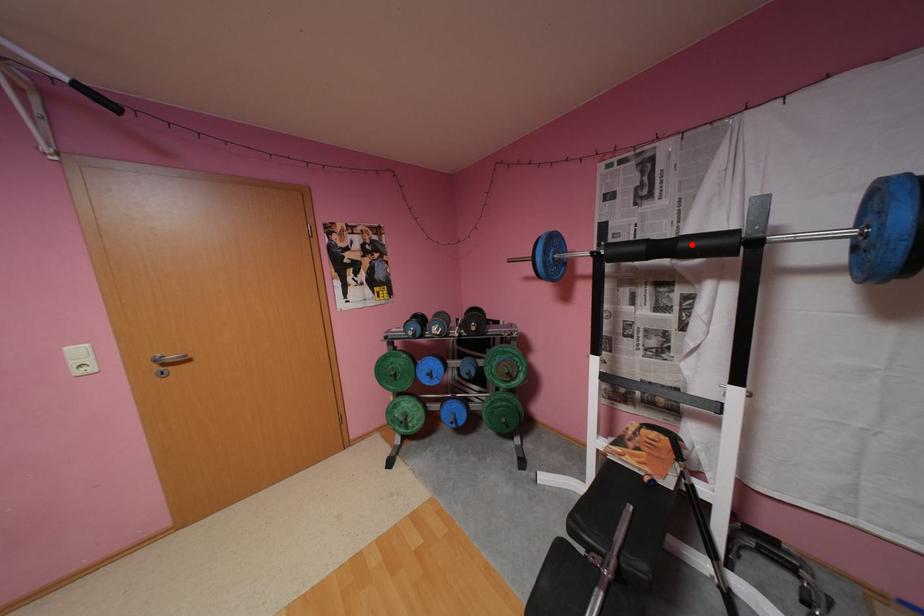
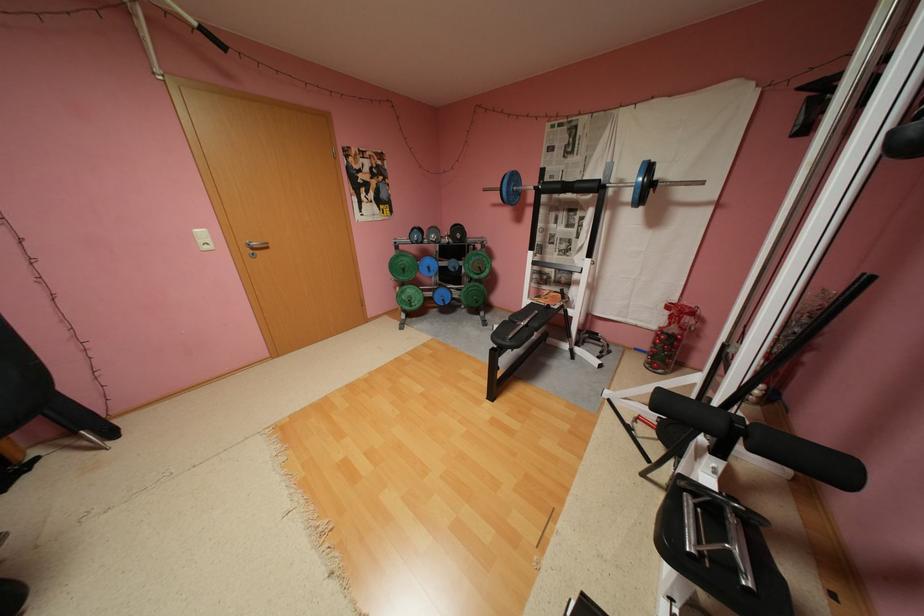
Find the pixel in the second image that matches the highlighted location in the first image.

(586, 185)